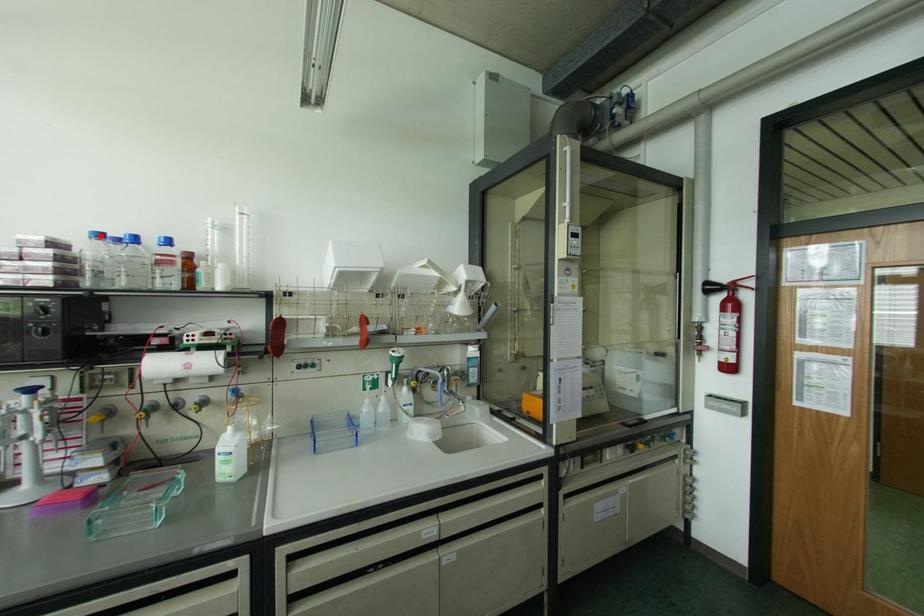
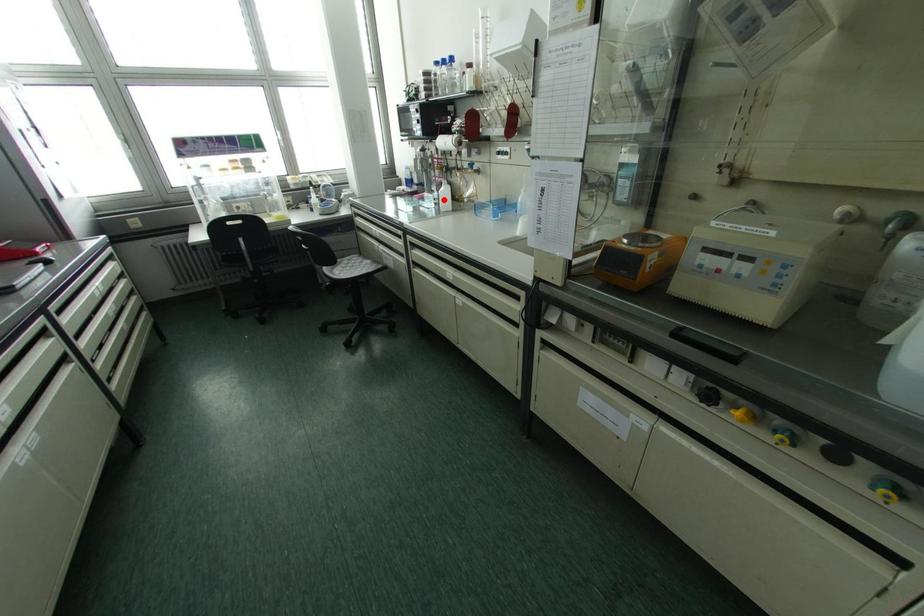
I am providing you with two images of the same scene from different viewpoints. A red point is marked on the first image and another point is marked on the second image. Does the point marked in image1 correspond to the same location as the one in image2?

No